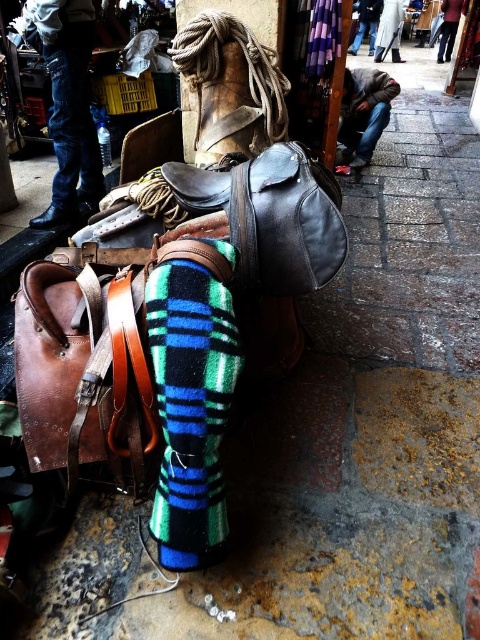
Is green plaid sock at center positioned in front of brown leather shoe at lower center?

Yes, green plaid sock at center is closer to the viewer.

From the picture: Can you confirm if green plaid sock at center is shorter than brown leather shoe at lower center?

No, green plaid sock at center is not shorter than brown leather shoe at lower center.

Is point (222, 531) behind point (367, 163)?

No, it is in front of (367, 163).

What are the coordinates of `green plaid sock at center` in the screenshot? It's located at (191, 406).

Describe the element at coordinates (54, 216) in the screenshot. I see `black leather shoe at lower left` at that location.

Is black leather shoe at lower left below brown leather shoe at lower center?

Indeed, black leather shoe at lower left is positioned under brown leather shoe at lower center.

Find the location of a particular element. The height and width of the screenshot is (640, 480). black leather shoe at lower left is located at coordinates (54, 216).

Describe the element at coordinates (191, 406) in the screenshot. The width and height of the screenshot is (480, 640). I see `green plaid sock at center` at that location.

Who is more distant from viewer, (159, 355) or (49, 209)?

The point (49, 209) is behind.

This screenshot has width=480, height=640. Find the location of `green plaid sock at center`. green plaid sock at center is located at coordinates (191, 406).